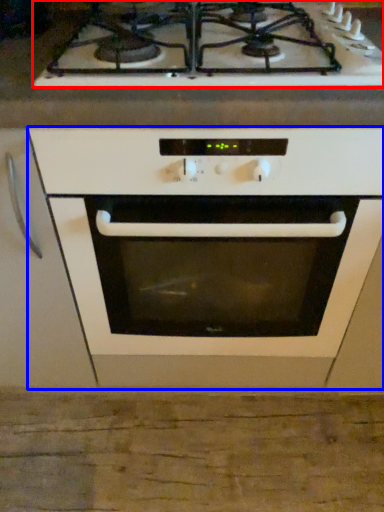
Question: Among these objects, which one is nearest to the camera, gas stove (highlighted by a red box) or oven (highlighted by a blue box)?

Choices:
 (A) gas stove
 (B) oven

Answer: (B)